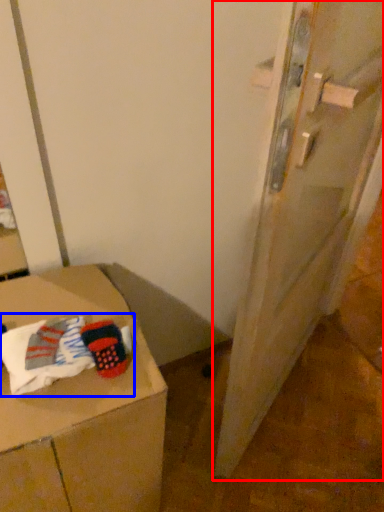
Question: Which object is further to the camera taking this photo, door (highlighted by a red box) or laundry (highlighted by a blue box)?

Choices:
 (A) door
 (B) laundry

Answer: (B)